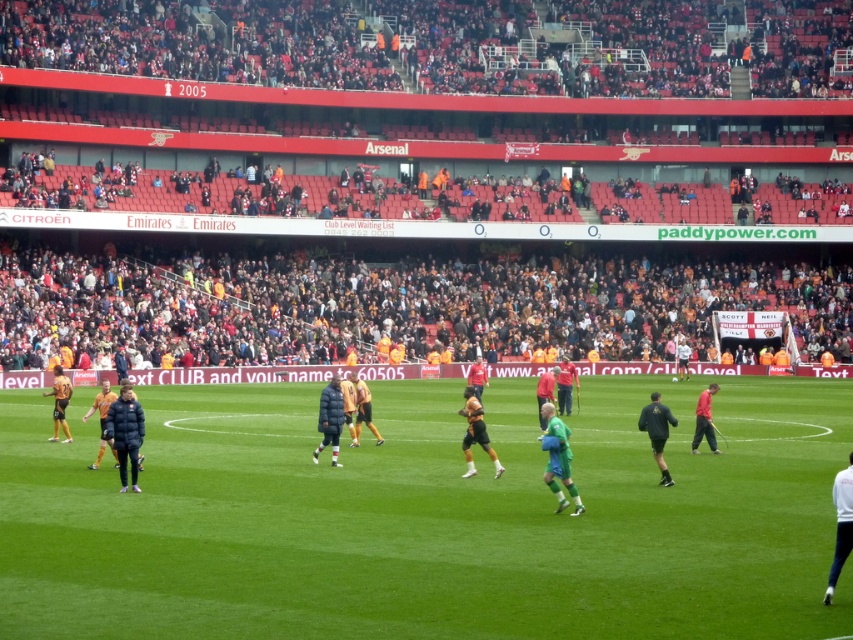
Question: Does green grass field at center have a larger size compared to dark blue padded jacket at center?

Choices:
 (A) yes
 (B) no

Answer: (A)

Question: Does matte black jacket at center appear on the left side of red matte shirt at center?

Choices:
 (A) no
 (B) yes

Answer: (B)

Question: Which object is the farthest from the red matte shirt at center?

Choices:
 (A) dark blue padded jacket at center
 (B) green grass field at center
 (C) dark blue jacket at center
 (D) black matte jacket at lower right

Answer: (B)

Question: Is matte black jacket at center above black matte jacket at lower right?

Choices:
 (A) yes
 (B) no

Answer: (A)

Question: Which point is farther from the camera taking this photo?

Choices:
 (A) (357, 433)
 (B) (337, 396)

Answer: (A)

Question: Which point is closer to the camera?

Choices:
 (A) (756, 392)
 (B) (637, 424)
 (C) (90, 413)

Answer: (B)